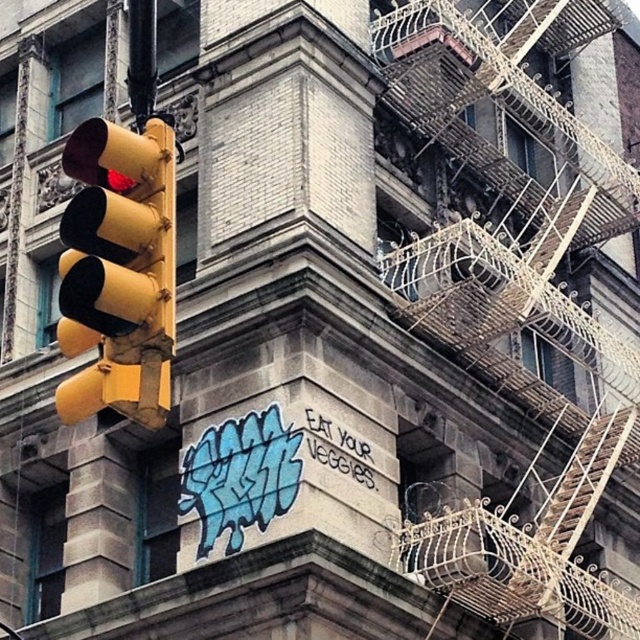
Question: Can you confirm if rustic metal fire escape at right is positioned to the right of yellow matte traffic light at left?

Choices:
 (A) no
 (B) yes

Answer: (B)

Question: Which of the following is the closest to the observer?

Choices:
 (A) (512, 176)
 (B) (134, 179)

Answer: (B)

Question: Can you confirm if rustic metal fire escape at right is positioned to the right of yellow matte traffic light at left?

Choices:
 (A) no
 (B) yes

Answer: (B)

Question: Which point is farther to the camera?

Choices:
 (A) (605, 228)
 (B) (154, 260)

Answer: (A)

Question: Which point is farther to the camera?

Choices:
 (A) (134, 333)
 (B) (592, 374)

Answer: (B)

Question: Does rustic metal fire escape at right have a larger size compared to yellow matte traffic light at left?

Choices:
 (A) no
 (B) yes

Answer: (B)